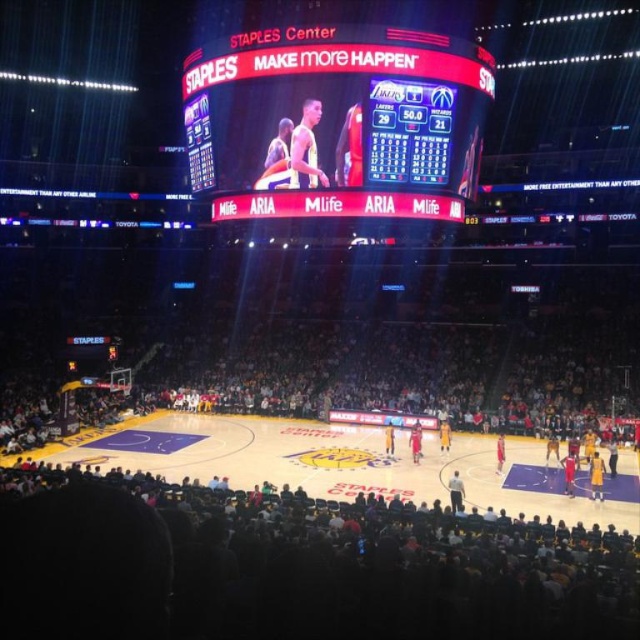
Which is below, matte digital scoreboard at upper center or purple polished wood court at center?

purple polished wood court at center

Can you confirm if matte digital scoreboard at upper center is taller than purple polished wood court at center?

Yes.

Which is in front, point (428, 81) or point (520, 456)?

Point (428, 81) is in front.

The width and height of the screenshot is (640, 640). I want to click on matte digital scoreboard at upper center, so click(x=339, y=120).